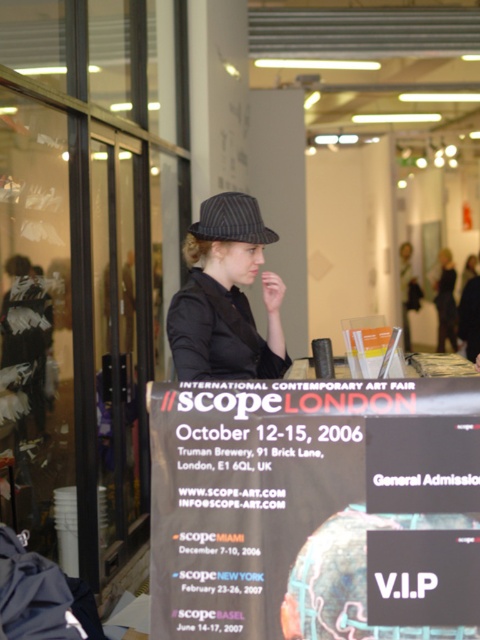
You are an art curator at SCOPE London and need to arrange two striped hats on a display stand. The striped fabric hat at center and the striped fabric baseball hat at center must be placed such that they are exactly 24.20 centimeters apart. Given that the display stand is 30 centimeters wide, can both hats fit side by side without overlapping?

The distance between the striped fabric hat at center and the striped fabric baseball hat at center is 24.20 centimeters. Since the display stand is 30 centimeters wide, which is wider than the required distance, both hats can fit side by side without overlapping.